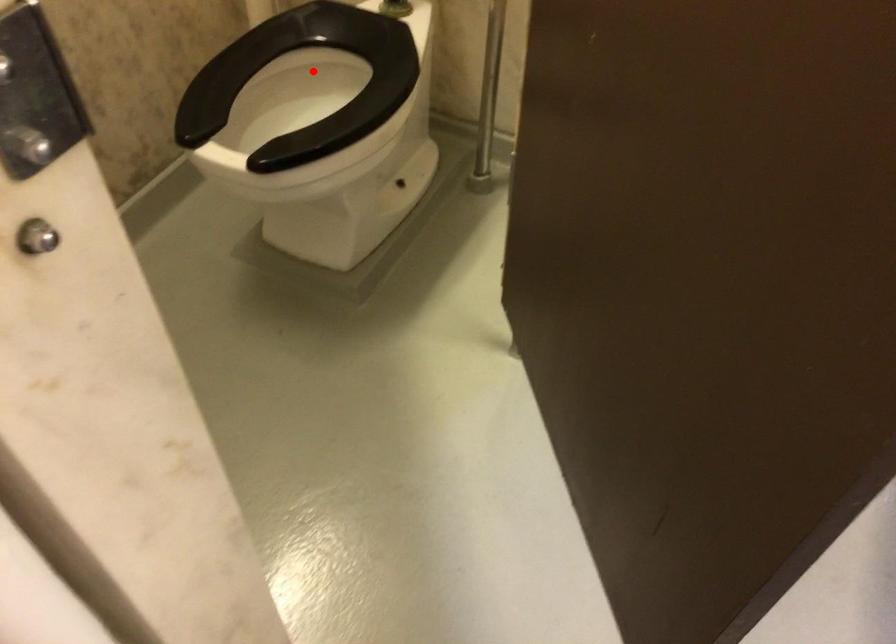
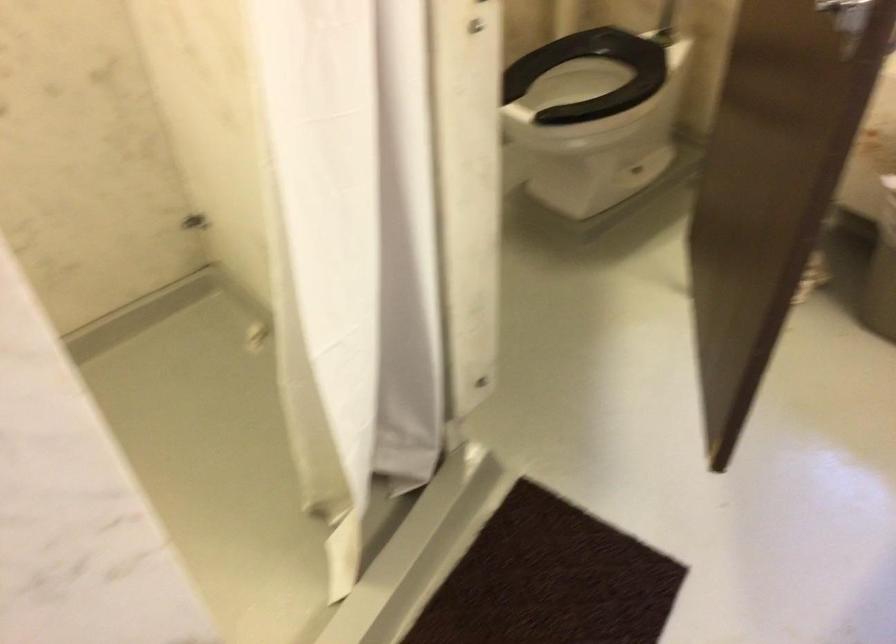
Question: I am providing you with two images of the same scene from different viewpoints. In image1, a red point is highlighted. Considering the same 3D point in image2, which of the following is correct?

Choices:
 (A) It is closer
 (B) It is farther

Answer: (B)